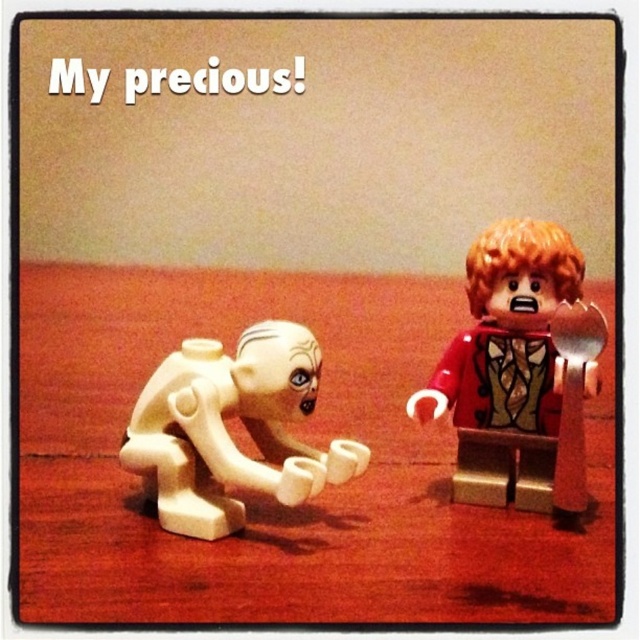
Is wooden table at center below white matte figure at lower left?

No.

Which is behind, point (122, 572) or point (209, 483)?

The point (209, 483) is behind.

At what (x,y) coordinates should I click in order to perform the action: click on wooden table at center. Please return your answer as a coordinate pair (x, y). Looking at the image, I should click on (300, 438).

Which is above, wooden table at center or reddish-brown fabric vest at right?

Positioned higher is wooden table at center.

Image resolution: width=640 pixels, height=640 pixels. What do you see at coordinates (300, 438) in the screenshot?
I see `wooden table at center` at bounding box center [300, 438].

You are a GUI agent. You are given a task and a screenshot of the screen. Output one action in this format:
    pyautogui.click(x=<x>, y=<y>)
    Task: Click on the wooden table at center
    This screenshot has height=640, width=640.
    Given the screenshot: What is the action you would take?
    pyautogui.click(x=300, y=438)

Can you confirm if reddish-brown fabric vest at right is wider than white matte figure at lower left?

Incorrect, reddish-brown fabric vest at right's width does not surpass white matte figure at lower left's.

Does reddish-brown fabric vest at right come behind white matte figure at lower left?

Yes, reddish-brown fabric vest at right is behind white matte figure at lower left.

Who is more forward, (548, 488) or (220, 412)?

Point (220, 412) is in front.

You are a GUI agent. You are given a task and a screenshot of the screen. Output one action in this format:
    pyautogui.click(x=<x>, y=<y>)
    Task: Click on the reddish-brown fabric vest at right
    
    Given the screenshot: What is the action you would take?
    click(516, 372)